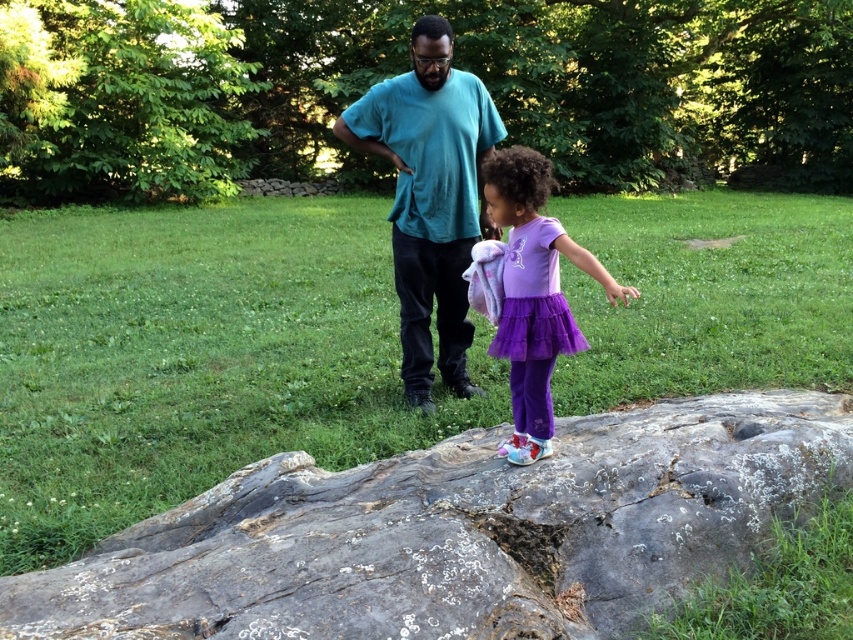
Can you confirm if rough gray rock at center is positioned below teal matte shirt at center?

Correct, rough gray rock at center is located below teal matte shirt at center.

Does point (224, 616) come in front of point (456, 70)?

That is True.

The height and width of the screenshot is (640, 853). In order to click on rough gray rock at center in this screenshot , I will do `click(457, 532)`.

Describe the element at coordinates (457, 532) in the screenshot. The width and height of the screenshot is (853, 640). I see `rough gray rock at center` at that location.

Is rough gray rock at center to the left of purple tulle skirt at center from the viewer's perspective?

Incorrect, rough gray rock at center is not on the left side of purple tulle skirt at center.

Between point (460, 605) and point (498, 163), which one is positioned behind?

Positioned behind is point (498, 163).

Image resolution: width=853 pixels, height=640 pixels. Find the location of `rough gray rock at center`. rough gray rock at center is located at coordinates (457, 532).

Is teal matte shirt at center smaller than purple tulle skirt at center?

Incorrect, teal matte shirt at center is not smaller in size than purple tulle skirt at center.

Does teal matte shirt at center have a greater height compared to purple tulle skirt at center?

Yes.

Measure the distance between teal matte shirt at center and camera.

They are 4.07 meters apart.

Find the location of a particular element. This screenshot has width=853, height=640. teal matte shirt at center is located at coordinates (430, 198).